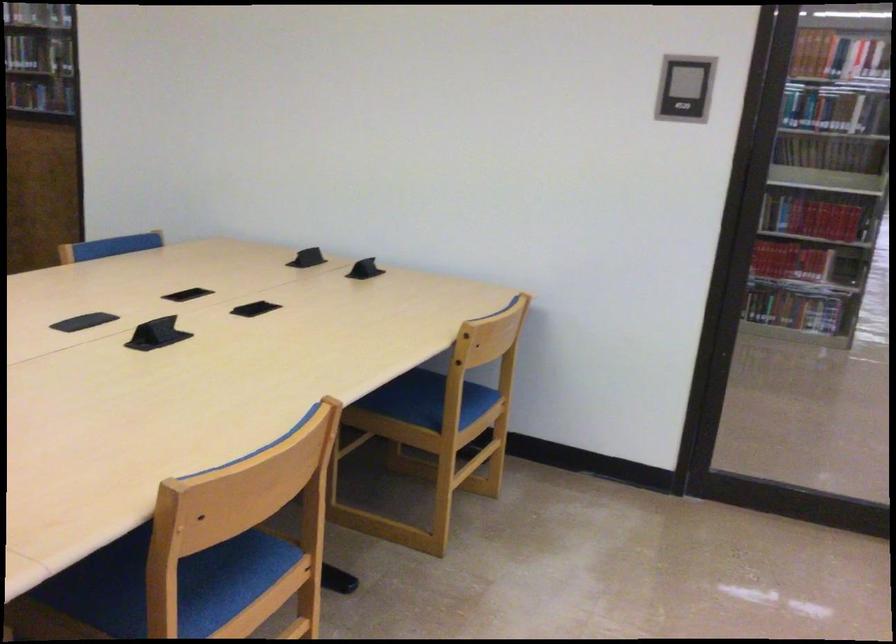
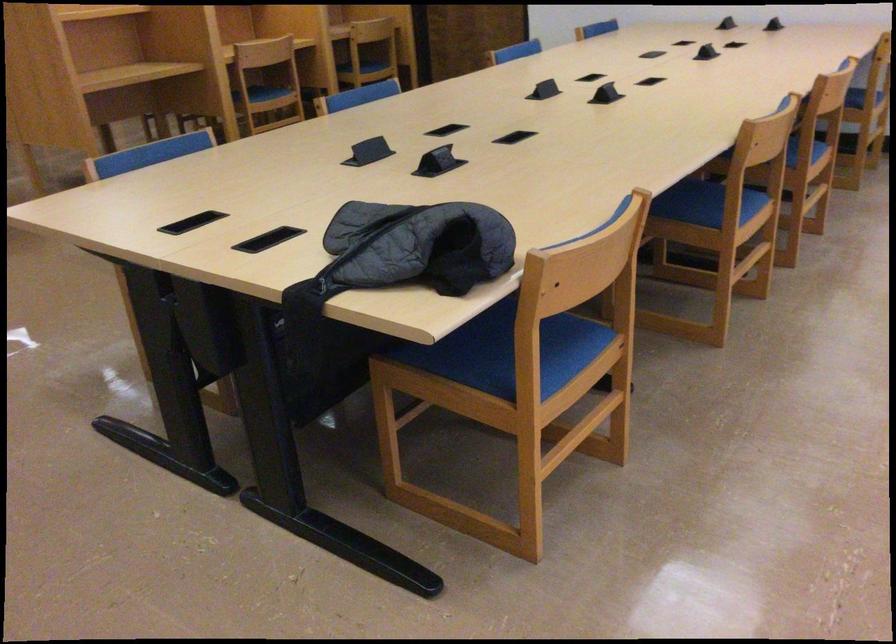
Locate, in the second image, the point that corresponds to [444,412] in the first image.

(869, 90)